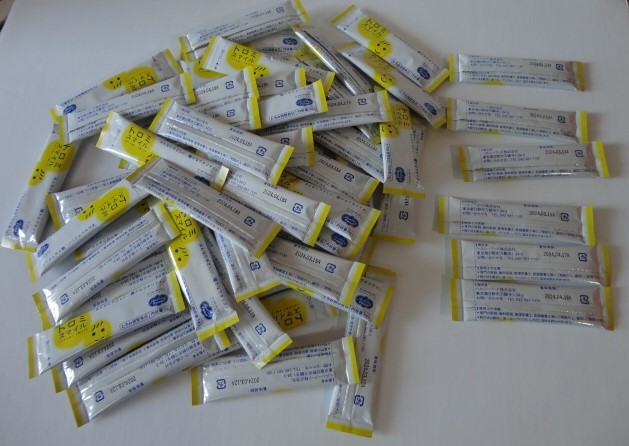
Locate an element on the screen. The height and width of the screenshot is (446, 629). table top is located at coordinates (87, 34), (487, 367).